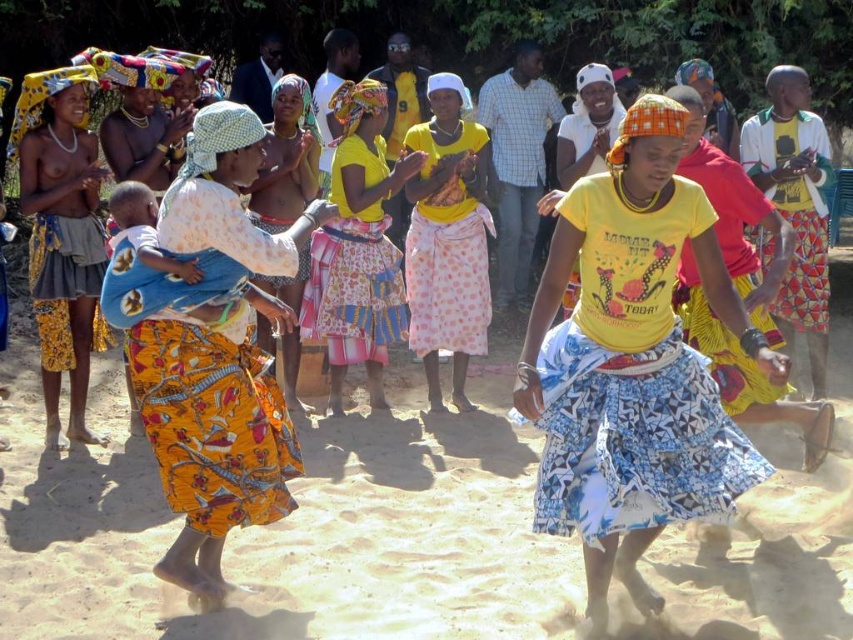
You are a photographer trying to capture a closeup of both the yellow fabric skirt at center and the yellow printed fabric at center in the scene. Given that your camera can only focus on objects within a 1 meter range, will you be able to capture both in a single shot?

The yellow fabric skirt at center and yellow printed fabric at center are 87.58 centimeters apart. Since 87.58 centimeters is less than 1 meter, the camera can focus on both objects within the 1 meter range, so yes, you can capture both in a single shot.

You are a photographer trying to capture the perfect shot of the yellow cotton skirt at center and the yellow printed shirt at center. Which object should you focus on first if you want to include both in your frame without cropping either?

The yellow cotton skirt at center is much taller than the yellow printed shirt at center, so you should focus on the yellow cotton skirt at center first to ensure it fits properly in the frame.

You are a photographer at the event and want to capture a photo where both the yellow cotton skirt at center and the yellow fabric skirt at center are visible. Which skirt will appear shorter in the photo?

The yellow cotton skirt at center will appear shorter in the photo because it has a lesser height compared to the yellow fabric skirt at center.